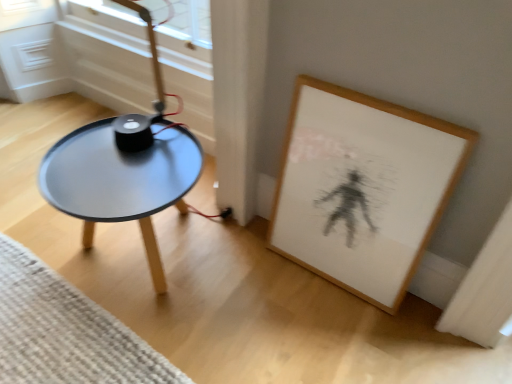
At what (x,y) coordinates should I click in order to perform the action: click on vacant area on top of matte black table at left (from a real-world perspective). Please return your answer as a coordinate pair (x, y). Looking at the image, I should click on (103, 168).